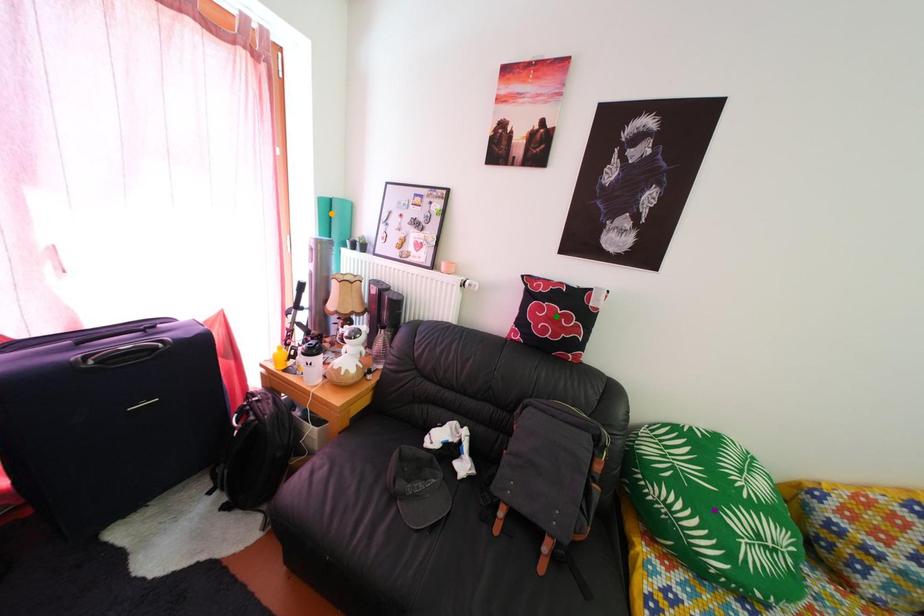
Order these from nearest to farthest:
purple point, green point, orange point

purple point, green point, orange point